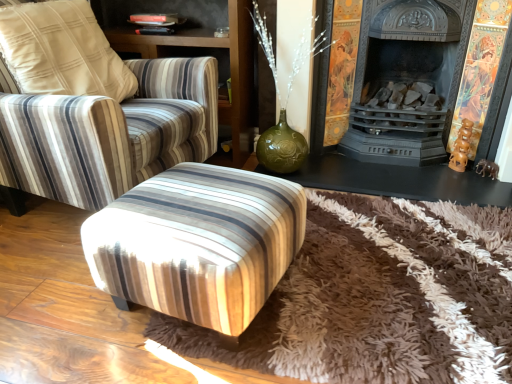
Question: Should I look upward or downward to see striped fabric chair at center?

Choices:
 (A) up
 (B) down

Answer: (A)

Question: From a real-world perspective, is brown shaggy rug at center beneath matte black fireplace at center?

Choices:
 (A) yes
 (B) no

Answer: (A)

Question: Is brown shaggy rug at center far away from matte black fireplace at center?

Choices:
 (A) yes
 (B) no

Answer: (B)

Question: Can you see brown shaggy rug at center touching matte black fireplace at center?

Choices:
 (A) yes
 (B) no

Answer: (B)

Question: Can you confirm if brown shaggy rug at center is positioned to the right of matte black fireplace at center?

Choices:
 (A) no
 (B) yes

Answer: (A)

Question: Is brown shaggy rug at center behind matte black fireplace at center?

Choices:
 (A) yes
 (B) no

Answer: (B)

Question: Would you say brown shaggy rug at center contains matte black fireplace at center?

Choices:
 (A) no
 (B) yes

Answer: (B)

Question: Considering the relative positions of black cast iron fireplace at center and matte black fireplace at center in the image provided, is black cast iron fireplace at center to the right of matte black fireplace at center from the viewer's perspective?

Choices:
 (A) no
 (B) yes

Answer: (B)

Question: Are black cast iron fireplace at center and matte black fireplace at center making contact?

Choices:
 (A) yes
 (B) no

Answer: (A)

Question: Is black cast iron fireplace at center bigger than matte black fireplace at center?

Choices:
 (A) no
 (B) yes

Answer: (B)

Question: Is black cast iron fireplace at center turned away from matte black fireplace at center?

Choices:
 (A) no
 (B) yes

Answer: (A)

Question: From a real-world perspective, is black cast iron fireplace at center on matte black fireplace at center?

Choices:
 (A) no
 (B) yes

Answer: (B)

Question: Considering the relative sizes of black cast iron fireplace at center and matte black fireplace at center in the image provided, is black cast iron fireplace at center shorter than matte black fireplace at center?

Choices:
 (A) yes
 (B) no

Answer: (B)

Question: Is brown shaggy rug at center looking in the opposite direction of striped fabric armchair at upper left?

Choices:
 (A) no
 (B) yes

Answer: (A)